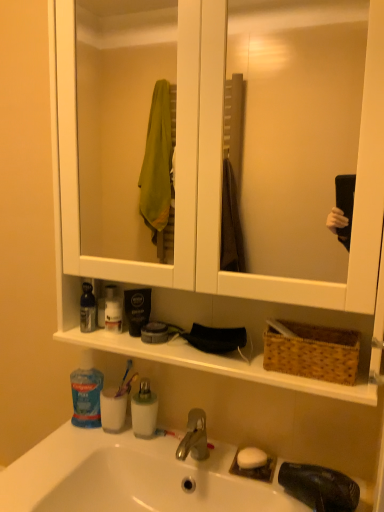
The height and width of the screenshot is (512, 384). What are the coordinates of `vacant space situated on the left part of blue translucent mouthwash at lower left, the first mouthwash positioned from the left` in the screenshot? It's located at point(61,442).